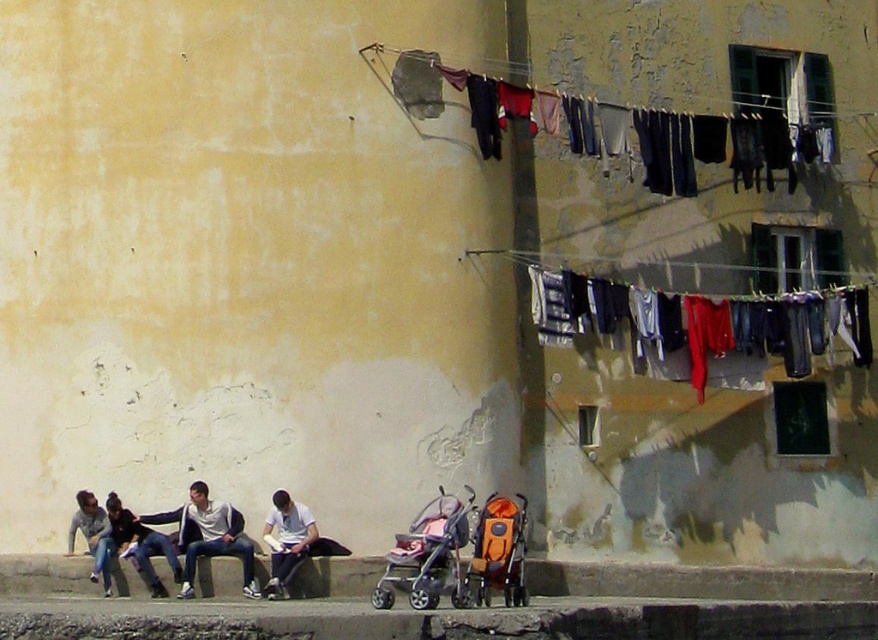
Can you confirm if concrete curb at lower left is wider than white matte shirt at lower center?

Correct, the width of concrete curb at lower left exceeds that of white matte shirt at lower center.

Does point (783, 586) come closer to viewer compared to point (292, 529)?

No.

Where is `concrete curb at lower left`? Image resolution: width=878 pixels, height=640 pixels. concrete curb at lower left is located at coordinates click(697, 580).

Can you confirm if concrete curb at lower left is positioned below white cotton shirt at center?

Yes, concrete curb at lower left is below white cotton shirt at center.

Does concrete curb at lower left come behind white cotton shirt at center?

Yes, concrete curb at lower left is further from the viewer.

Where is `concrete curb at lower left`? concrete curb at lower left is located at coordinates (697, 580).

Where is `concrete curb at lower left`? Image resolution: width=878 pixels, height=640 pixels. concrete curb at lower left is located at coordinates (697, 580).

Between multicolored fabric clothesline at upper right and pink fabric baby carriage at center, which one has less height?

With less height is pink fabric baby carriage at center.

Can you confirm if multicolored fabric clothesline at upper right is taller than pink fabric baby carriage at center?

Yes.

Where is `multicolored fabric clothesline at upper right`? multicolored fabric clothesline at upper right is located at coordinates (725, 147).

At what (x,y) coordinates should I click in order to perform the action: click on multicolored fabric clothesline at upper right. Please return your answer as a coordinate pair (x, y). This screenshot has width=878, height=640. Looking at the image, I should click on (725, 147).